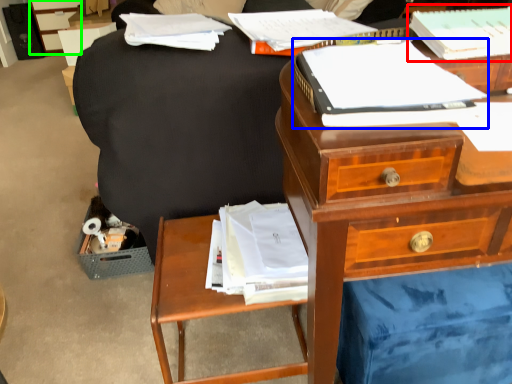
Question: Which object is positioned closest to paperback book (highlighted by a red box)? Select from paperback book (highlighted by a blue box) and file cabinet (highlighted by a green box).

Choices:
 (A) paperback book
 (B) file cabinet

Answer: (A)